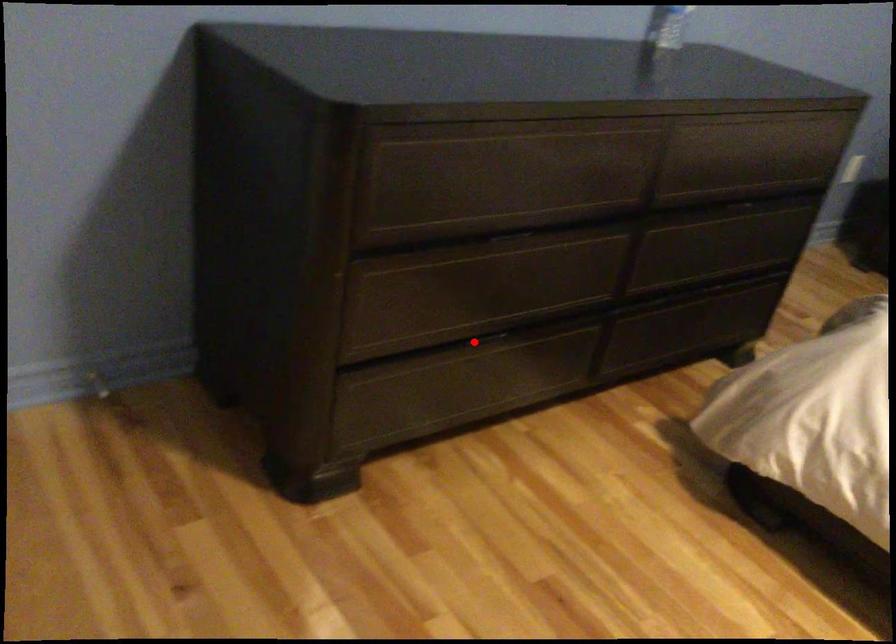
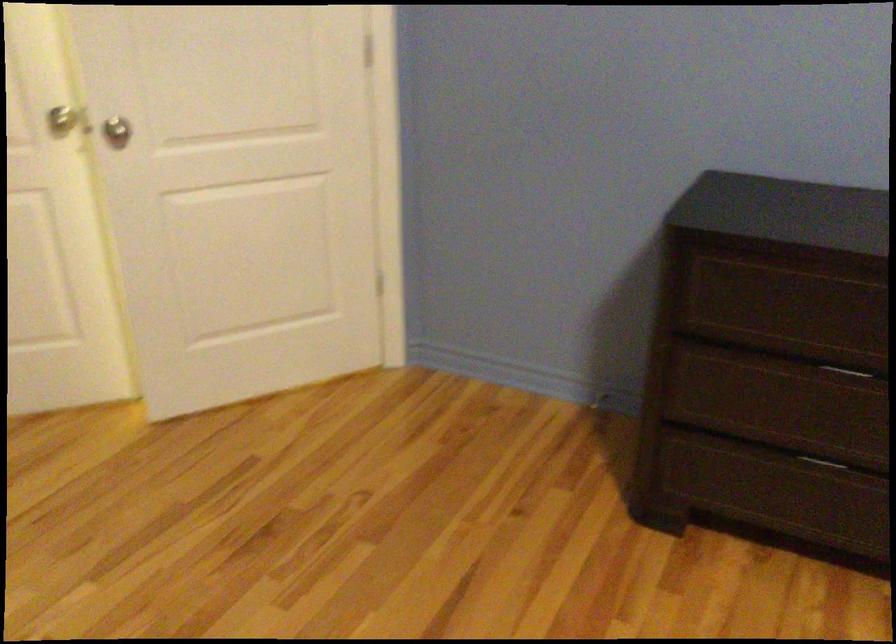
Question: I am providing you with two images of the same scene from different viewpoints. A red point is marked on the first image. Is the red point's position out of view in image 2?

Choices:
 (A) Yes
 (B) No

Answer: (B)